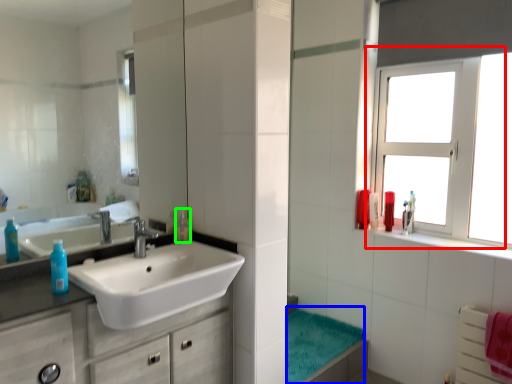
Question: Which object is positioned closest to window (highlighted by a red box)? Select from bath towel (highlighted by a blue box) and mouthwash (highlighted by a green box).

Choices:
 (A) bath towel
 (B) mouthwash

Answer: (A)